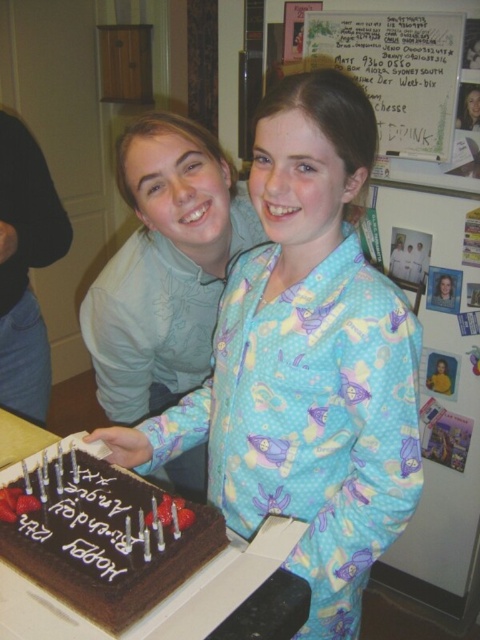
You are a guest at the birthday party and want to take a photo with the birthday person. You are standing behind the blue cotton pajamas at center and the chocolatesmoothcake at center. To get a clear shot of both the birthday person and the cake, should you move to the left or right of the current position?

You should move to the left of your current position because the blue cotton pajamas at center are to the right of the chocolatesmoothcake at center. Moving left would allow you to capture both the birthday person in the blue cotton pajamas at center and the chocolatesmoothcake at center in the frame.

You are a photographer standing 5 feet away from the blue cotton pajamas at center and the white paper at upper center. You want to capture a photo where both objects are in focus. Given that your camera has a depth of field that can sharply focus objects within a 36 inch range, will both objects be in focus?

The distance between the blue cotton pajamas at center and the white paper at upper center is 36.87 inches. Since the camera can only sharply focus within a 36 inch range, the objects are slightly beyond the depth of field. Therefore, both objects might not be in focus simultaneously.

You are standing in the room and notice two points marked in the image. The first point is at coordinate point (x=144, y=534) and the second point is at coordinate point (x=404, y=42). Which point is closer to you?

Point (x=144, y=534) is closer to the viewer than point (x=404, y=42).